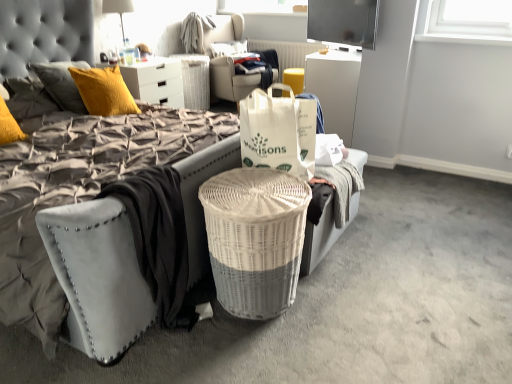
Question: Relative to white woven bag at center, is white wicker trash bin/can at center in front or behind?

Choices:
 (A) front
 (B) behind

Answer: (B)

Question: From their relative heights in the image, would you say white wicker trash bin/can at center is taller or shorter than white woven bag at center?

Choices:
 (A) tall
 (B) short

Answer: (A)

Question: Based on their relative distances, which object is farther from the suede-like gray mattress at lower left?

Choices:
 (A) matte white dresser at upper center
 (B) white glossy desk at upper center
 (C) white textured bean bag chair at center
 (D) clear glass bottle at upper center
 (E) white wicker picnic basket at center

Answer: (C)

Question: Which object is the farthest from the matte white lamp at upper center?

Choices:
 (A) white woven bag at center
 (B) white wicker picnic basket at center
 (C) white glossy desk at upper center
 (D) matte white dresser at upper center
 (E) flat screen tv at upper center

Answer: (B)